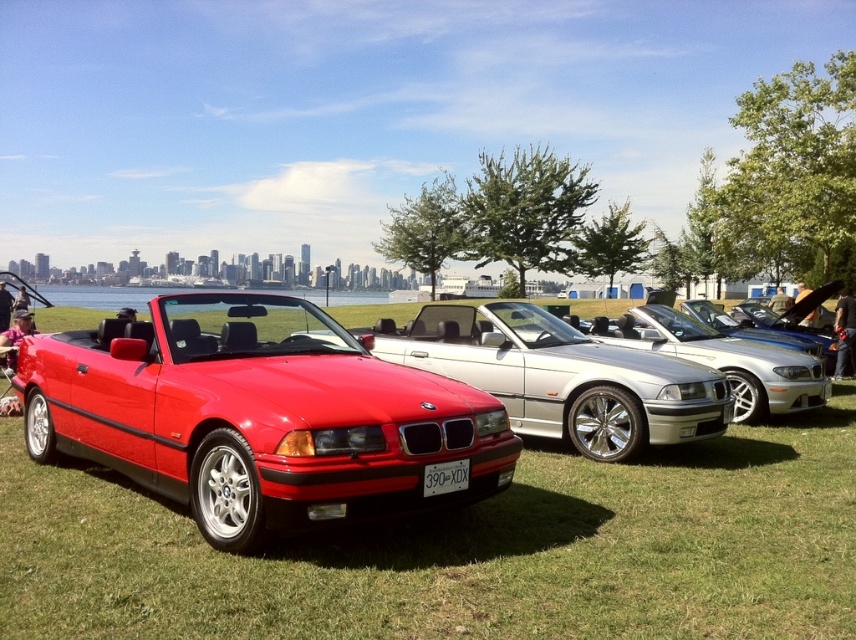
You are standing in front of the red BMW convertible and notice two points marked in the image. The first point is at coordinates point (177, 388) and the second is at point (524, 401). Which point is closer to you?

Point (177, 388) is closer to the viewer than point (524, 401).

You are a photographer planning to take a photo of the matte red convertible at left and the shiny metallic silver convertible at center. If you want to capture both cars in the same frame without moving your camera position, which car should you focus on first to ensure both are in focus?

The matte red convertible at left is in front of the shiny metallic silver convertible at center, so you should focus on the shiny metallic silver convertible at center first to ensure both are in focus.

You are standing at the point marked by coordinates point [259,417] in the image. What object are you facing?

The point [259,417] indicates the matte red convertible at left, so you are facing the matte red convertible at left.